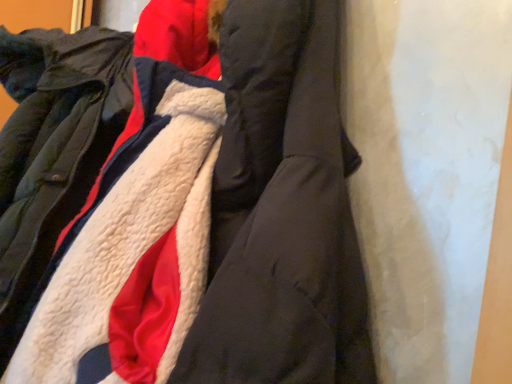
What is the approximate height of white fleece blanket at upper left?

It is 34.29 inches.

The image size is (512, 384). What do you see at coordinates (133, 258) in the screenshot? I see `white fleece blanket at upper left` at bounding box center [133, 258].

Where is `white fleece blanket at upper left`? This screenshot has width=512, height=384. white fleece blanket at upper left is located at coordinates (133, 258).

Locate an element on the screen. The image size is (512, 384). white fleece blanket at upper left is located at coordinates (133, 258).